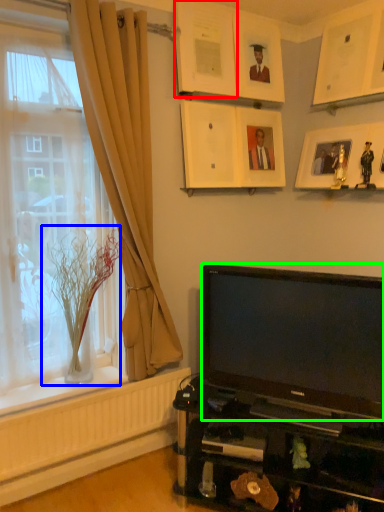
Question: Based on their relative distances, which object is nearer to picture frame (highlighted by a red box)? Choose from glass vase (highlighted by a blue box) and television (highlighted by a green box).

Choices:
 (A) glass vase
 (B) television

Answer: (A)